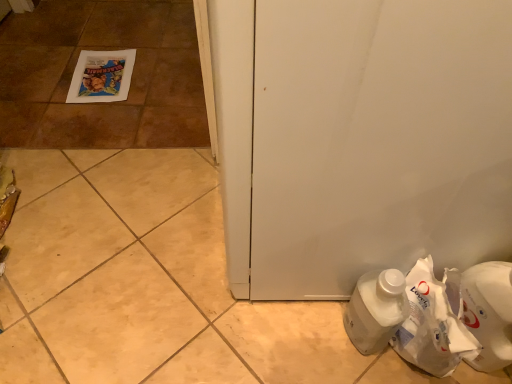
Question: Is matte paper poster at upper left far from white plastic bottle at lower right?

Choices:
 (A) yes
 (B) no

Answer: (A)

Question: Is matte paper poster at upper left in front of white plastic bottle at lower right?

Choices:
 (A) yes
 (B) no

Answer: (B)

Question: From a real-world perspective, is matte paper poster at upper left positioned under white plastic bottle at lower right based on gravity?

Choices:
 (A) yes
 (B) no

Answer: (A)

Question: Would you say white plastic bottle at lower right is part of matte paper poster at upper left's contents?

Choices:
 (A) yes
 (B) no

Answer: (B)

Question: From the image's perspective, is matte paper poster at upper left beneath white plastic bottle at lower right?

Choices:
 (A) yes
 (B) no

Answer: (B)

Question: Considering the positions of white plastic bottle at lower right and white paper bag at lower right in the image, is white plastic bottle at lower right bigger or smaller than white paper bag at lower right?

Choices:
 (A) small
 (B) big

Answer: (A)

Question: Does point (367, 347) appear closer or farther from the camera than point (406, 347)?

Choices:
 (A) farther
 (B) closer

Answer: (A)

Question: In the image, is white plastic bottle at lower right positioned in front of or behind white paper bag at lower right?

Choices:
 (A) front
 (B) behind

Answer: (B)

Question: In terms of width, does white plastic bottle at lower right look wider or thinner when compared to white paper bag at lower right?

Choices:
 (A) wide
 (B) thin

Answer: (B)

Question: Is matte paper poster at upper left inside the boundaries of white plastic bottle at lower right, or outside?

Choices:
 (A) outside
 (B) inside

Answer: (A)

Question: Considering the positions of point (143, 72) and point (361, 329), is point (143, 72) closer or farther from the camera than point (361, 329)?

Choices:
 (A) closer
 (B) farther

Answer: (B)

Question: Considering the positions of matte paper poster at upper left and white plastic bottle at lower right in the image, is matte paper poster at upper left taller or shorter than white plastic bottle at lower right?

Choices:
 (A) short
 (B) tall

Answer: (A)

Question: Based on their sizes in the image, would you say matte paper poster at upper left is bigger or smaller than white plastic bottle at lower right?

Choices:
 (A) big
 (B) small

Answer: (B)

Question: Is white plastic bottle at lower right in front of or behind matte paper poster at upper left in the image?

Choices:
 (A) behind
 (B) front

Answer: (B)

Question: From a real-world perspective, relative to matte paper poster at upper left, is white plastic bottle at lower right vertically above or below?

Choices:
 (A) above
 (B) below

Answer: (A)